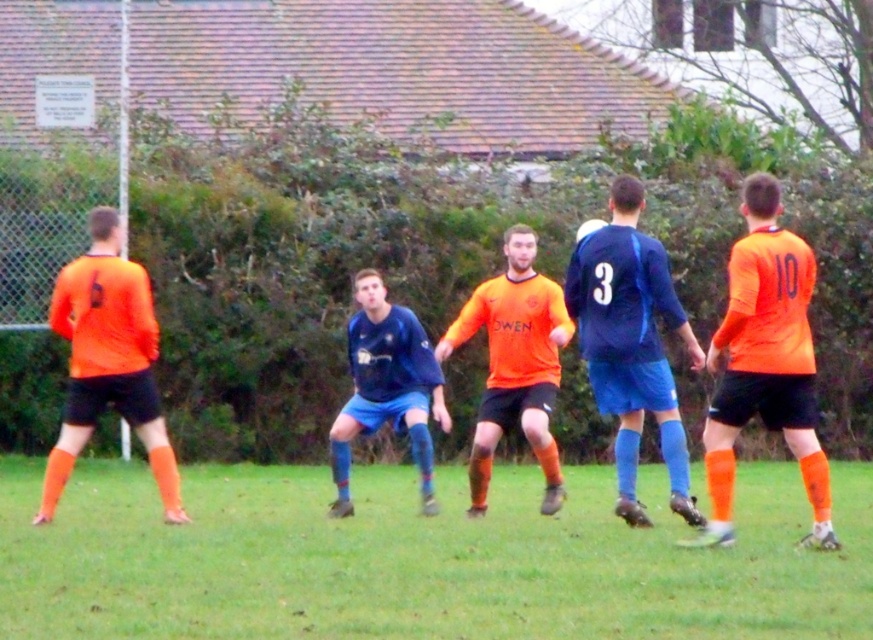
You are a soccer referee observing the match. You need to determine which player is closer to you. Which player is nearer to you, the orange matte jersey at right or the blue matte jersey at center?

The orange matte jersey at right is closer to the viewer than the blue matte jersey at center, so the orange matte jersey at right is nearer to you.

You are a soccer referee standing at the midpoint of the field. You need to determine if the two players, the orange matte jersey at right and the blue matte jersey at center, are within the 36 inches required for a legal tackle. Based on their current positions, what is your ruling?

The orange matte jersey at right and blue matte jersey at center are 30.04 inches apart from each other, which is within the 36 inches required for a legal tackle. Therefore, the tackle is legal.